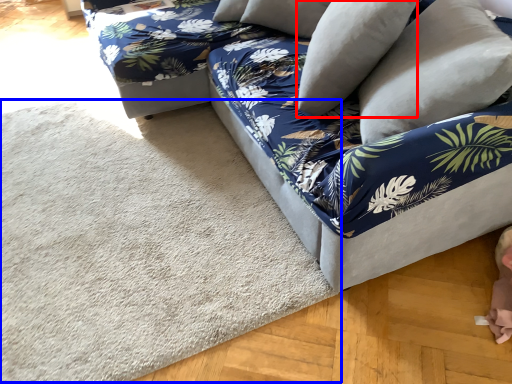
Question: Which of the following is the farthest to the observer, pillow (highlighted by a red box) or mat (highlighted by a blue box)?

Choices:
 (A) pillow
 (B) mat

Answer: (A)